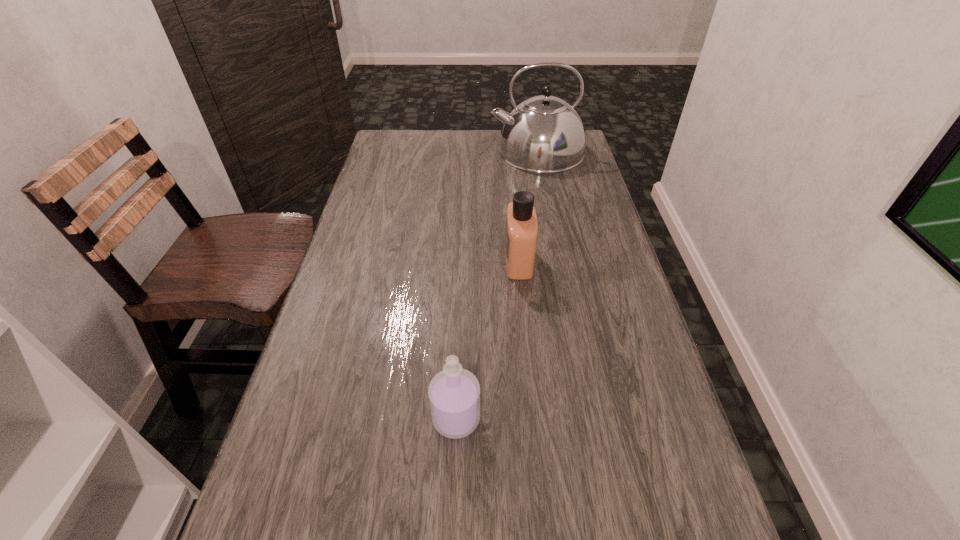
This screenshot has height=540, width=960. I want to click on kettle, so click(x=544, y=134).

At what (x,y) coordinates should I click in order to perform the action: click on the farthest object. Please return your answer as a coordinate pair (x, y). The width and height of the screenshot is (960, 540). Looking at the image, I should click on (544, 134).

The height and width of the screenshot is (540, 960). What are the coordinates of `the second nearest object` in the screenshot? It's located at (521, 232).

Find the location of a particular element. The height and width of the screenshot is (540, 960). the right perfume is located at coordinates (521, 232).

Find the location of a particular element. The image size is (960, 540). the nearest object is located at coordinates (454, 393).

What are the coordinates of `the nearer perfume` in the screenshot? It's located at (454, 393).

The image size is (960, 540). Identify the location of blank area located from the spout of the tallest object. (385, 151).

Locate an element on the screen. The width and height of the screenshot is (960, 540). blank area located from the spout of the tallest object is located at coordinates (420, 151).

The width and height of the screenshot is (960, 540). I want to click on free region located 0.230m from the spout of the tallest object, so click(425, 151).

I want to click on vacant space located 0.190m on the front label of the farther perfume, so click(x=431, y=261).